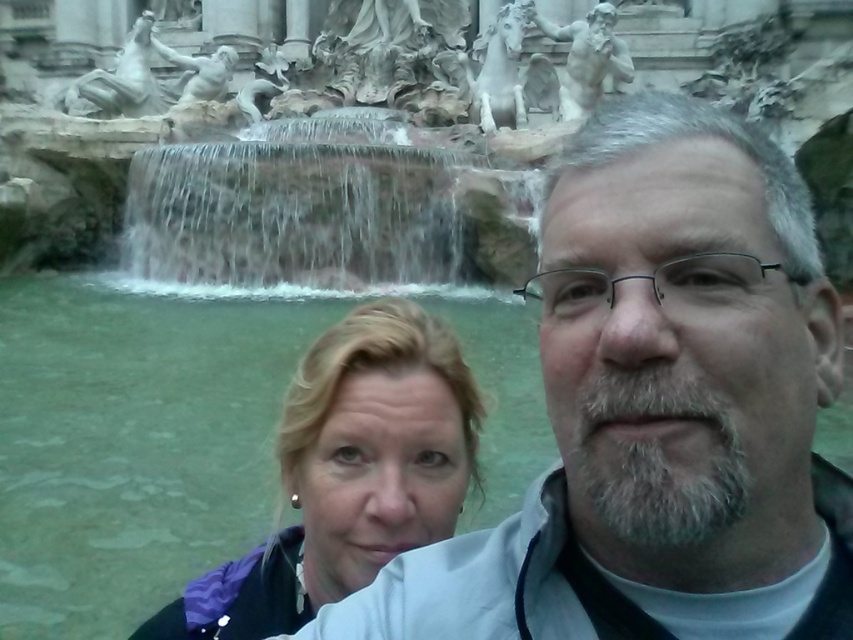
You are a photographer trying to capture the rustic stone waterfall at center and the blonde hair at center in the same frame. Based on their positions, which one should you focus on first to ensure both are in focus?

The rustic stone waterfall at center is located above the blonde hair at center, so you should focus on the rustic stone waterfall at center first to ensure both are in focus.

You are a photographer trying to capture a wide shot of the gray hair at center and the rustic stone waterfall at center. Based on their sizes, which object would you need to focus on more to ensure both are in frame?

The gray hair at center has a lesser width compared to rustic stone waterfall at center, so you should focus on the rustic stone waterfall at center to ensure both fit in the frame.